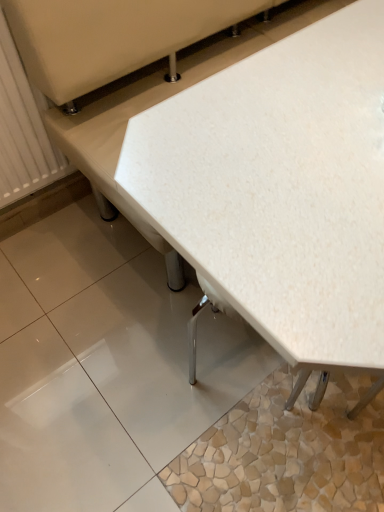
What are the coordinates of `empty space that is ontop of white speckled plastic table at center (from a real-world perspective)` in the screenshot? It's located at (309, 123).